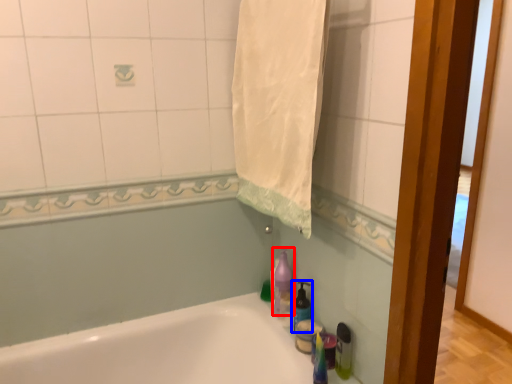
Question: Which of the following is the closest to the observer, cleaning product (highlighted by a red box) or soap dispenser (highlighted by a blue box)?

Choices:
 (A) cleaning product
 (B) soap dispenser

Answer: (B)